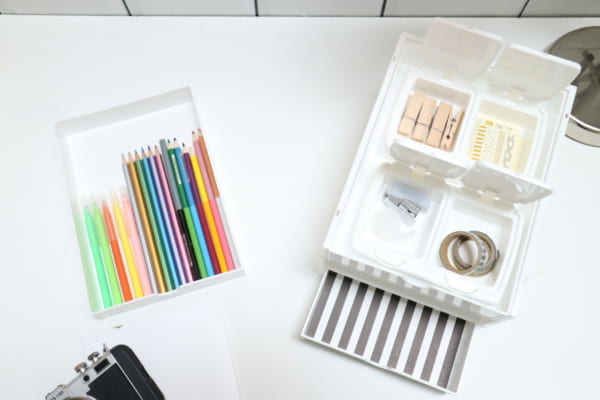
Where is `tiles`? This screenshot has height=400, width=600. tiles is located at coordinates (79, 4), (169, 9), (314, 9), (456, 13), (567, 3).